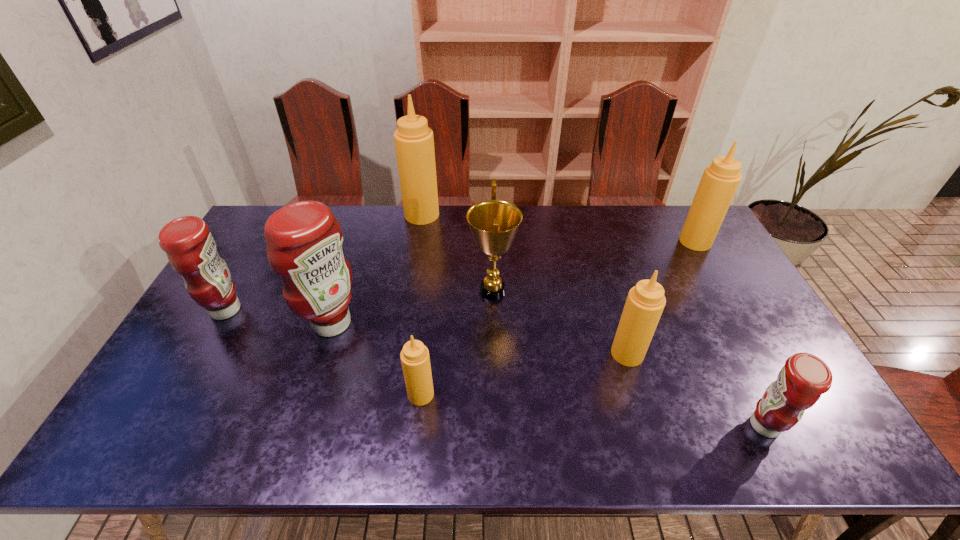
I want to click on the second smallest red condiment, so click(191, 249).

You are a GUI agent. You are given a task and a screenshot of the screen. Output one action in this format:
    pyautogui.click(x=<x>, y=<y>)
    Task: Click on the leftmost red condiment
    The height and width of the screenshot is (540, 960).
    Given the screenshot: What is the action you would take?
    pyautogui.click(x=191, y=249)

I want to click on the nearest tan condiment, so click(415, 360).

You are a GUI agent. You are given a task and a screenshot of the screen. Output one action in this format:
    pyautogui.click(x=<x>, y=<y>)
    Task: Click on the rightmost red condiment
    This screenshot has width=960, height=540.
    Given the screenshot: What is the action you would take?
    pyautogui.click(x=803, y=379)

Locate an element on the screen. the smallest red condiment is located at coordinates (x=803, y=379).

Identify the location of free space located 0.300m on the right of the tallest condiment. (518, 215).

The image size is (960, 540). I want to click on free location located on the front of the rightmost tan condiment, so click(725, 293).

Find the location of a particular element. The width and height of the screenshot is (960, 540). free space located on the left of the second red condiment from right to left is located at coordinates (285, 323).

You are a GUI agent. You are given a task and a screenshot of the screen. Output one action in this format:
    pyautogui.click(x=<x>, y=<y>)
    Task: Click on the free space located 0.160m on the front view with handles of the award
    
    Given the screenshot: What is the action you would take?
    pyautogui.click(x=417, y=291)

Image resolution: width=960 pixels, height=540 pixels. I want to click on free point located on the front view with handles of the award, so click(x=423, y=291).